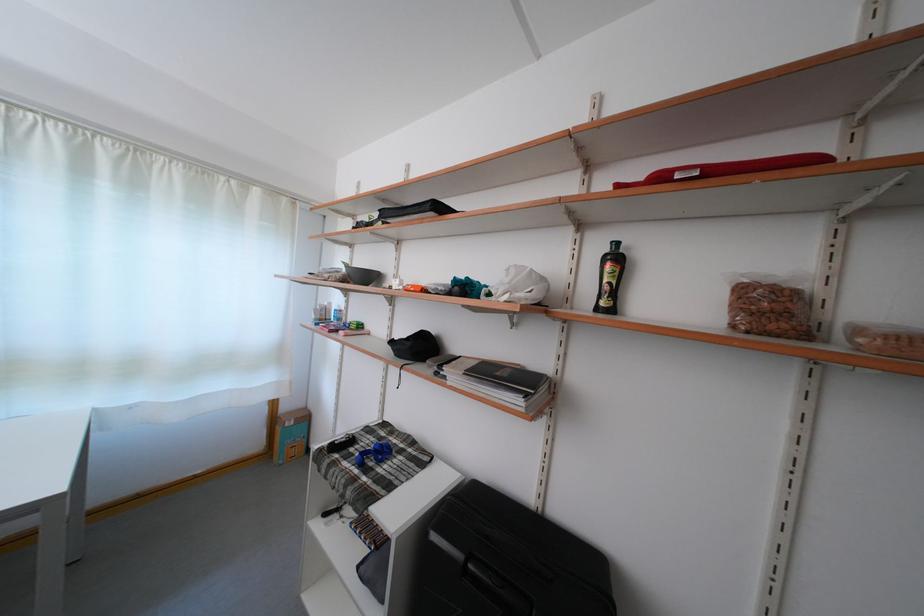
Where would you lift the cardboard box? Please return your answer as a coordinate pair (x, y).

(290, 436)